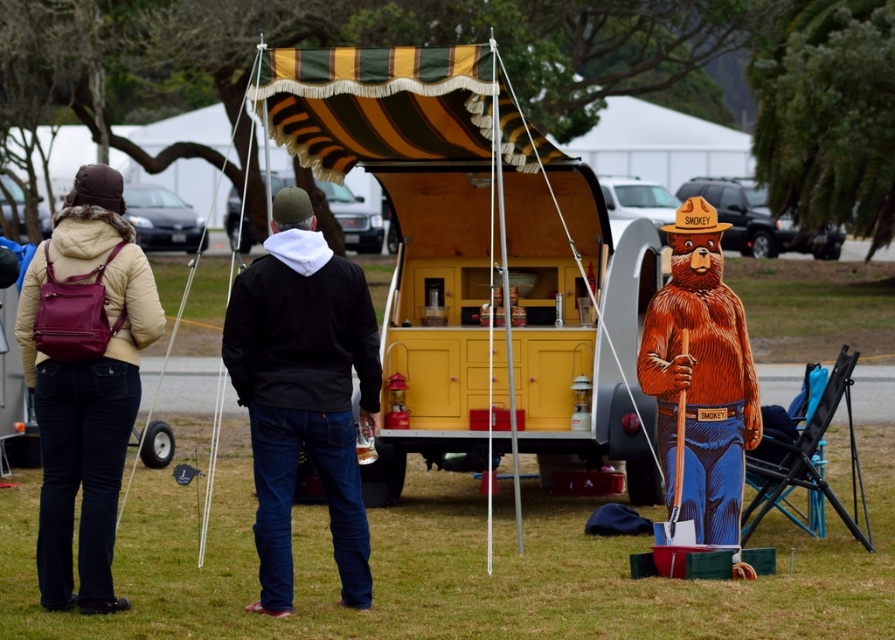
You are standing in front of the vintage trailer and want to walk towards the two points marked in the image. Which point, point (x=493, y=356) or point (x=270, y=253), will you reach first?

Point (x=493, y=356) is closer to the viewer than point (x=270, y=253), so you will reach point (x=493, y=356) first.